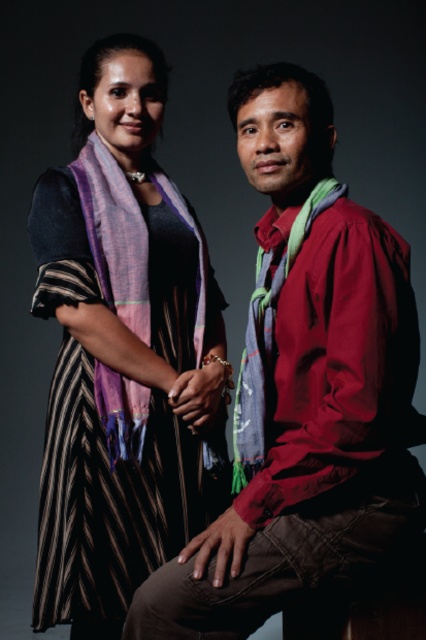
You are a photographer setting up for a photoshoot. You need to ensure that the striped fabric dress at center and the blue textured scarf at center are positioned so that they are at least 15 inches apart to avoid overlapping in the frame. Based on the current setup, is this requirement met?

The striped fabric dress at center is only 12.97 inches away from the blue textured scarf at center, which is less than the required 15 inches. Therefore, the requirement is not met, and adjustments are needed to increase the distance between them.

You are a fashion designer who wants to create a new collection using the striped fabric dress at center and the blue textured scarf at center. Which item should you choose if you need a larger piece of fabric for your design?

The striped fabric dress at center is larger in size than the blue textured scarf at center, so you should choose the striped fabric dress at center for your design as it provides a larger piece of fabric.